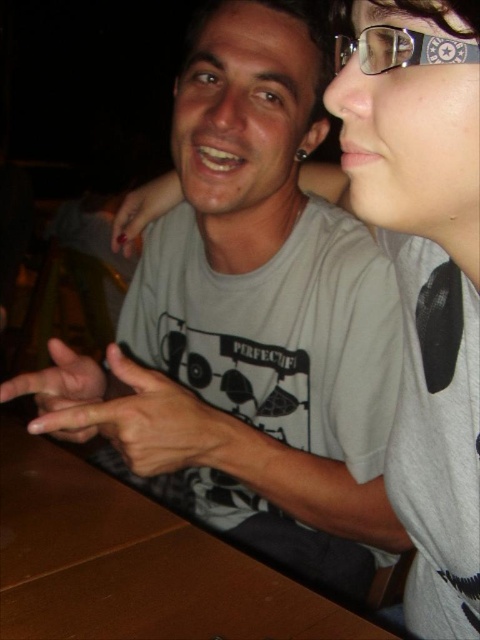
Can you confirm if matte gray hands at center is smaller than matte skin hand at center?

No, matte gray hands at center is not smaller than matte skin hand at center.

I want to click on matte gray hands at center, so tap(132, 413).

Which is behind, point (158, 468) or point (96, 432)?

Positioned behind is point (96, 432).

Locate an element on the screen. matte gray hands at center is located at coordinates (132, 413).

Which is above, matte skin hand at center or nail polish at left?

nail polish at left is above.

This screenshot has width=480, height=640. Find the location of `matte skin hand at center`. matte skin hand at center is located at coordinates (60, 392).

Who is more forward, (84,435) or (171,188)?

Positioned in front is point (84,435).

Image resolution: width=480 pixels, height=640 pixels. I want to click on matte skin hand at center, so click(x=60, y=392).

Is matte skin hand at center thinner than clear plastic glasses at upper right?

No.

Who is more distant from viewer, (64, 432) or (396, 38)?

The point (64, 432) is more distant.

You are a GUI agent. You are given a task and a screenshot of the screen. Output one action in this format:
    pyautogui.click(x=<x>, y=<y>)
    Task: Click on the matte skin hand at center
    This screenshot has height=640, width=480.
    Given the screenshot: What is the action you would take?
    pyautogui.click(x=60, y=392)